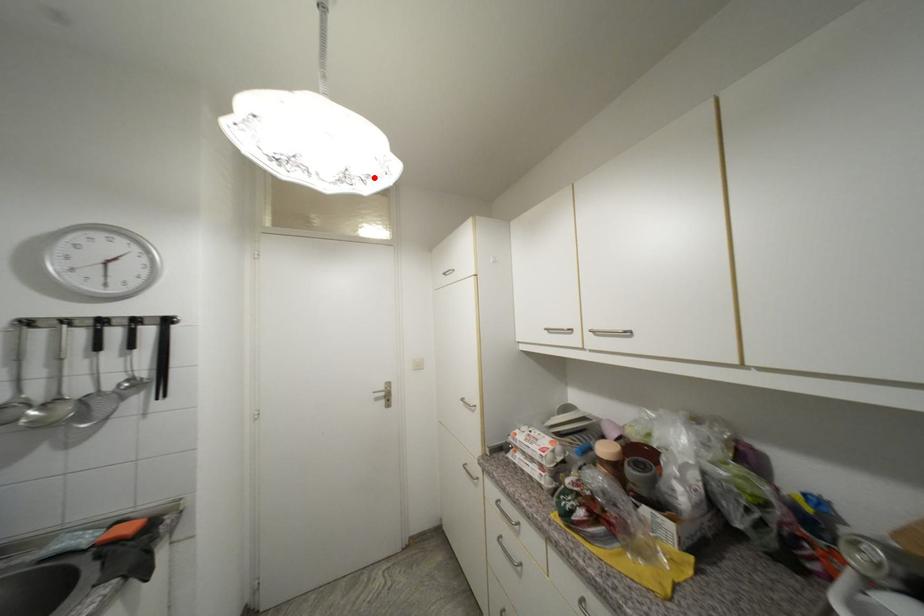
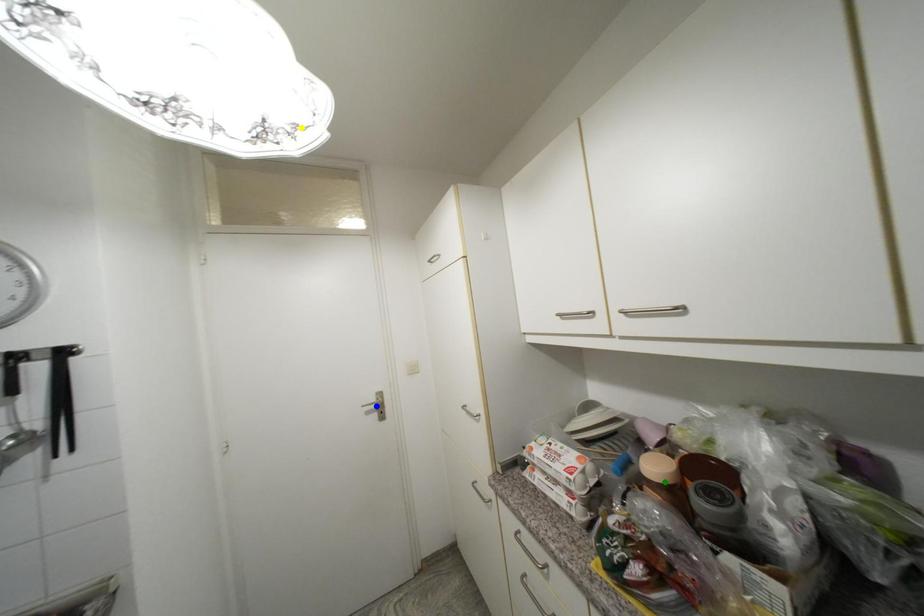
Question: I am providing you with two images of the same scene from different viewpoints. A red point is marked on the first image. You are given multiple points on the second image. Which point in image 2 represents the same 3d spot as the red point in image 1?

Choices:
 (A) blue point
 (B) yellow point
 (C) green point

Answer: (B)